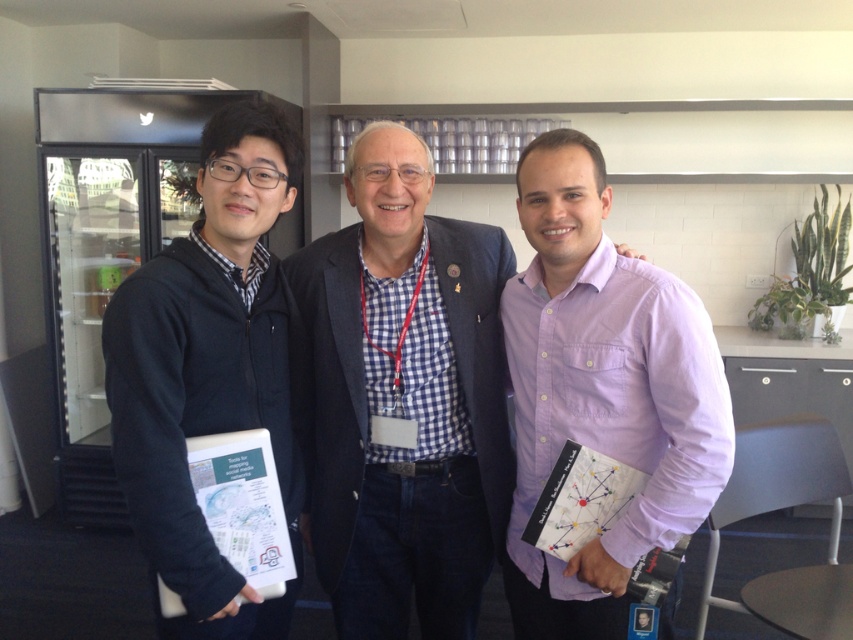
Question: Which point is farther to the camera?

Choices:
 (A) (231, 305)
 (B) (366, 445)
 (C) (718, 440)

Answer: (B)

Question: Is purple cotton shirt at center behind dark blue hoodie at left?

Choices:
 (A) no
 (B) yes

Answer: (B)

Question: Considering the relative positions of purple cotton shirt at center and dark blue hoodie at left in the image provided, where is purple cotton shirt at center located with respect to dark blue hoodie at left?

Choices:
 (A) right
 (B) left

Answer: (A)

Question: Which point is closer to the camera?

Choices:
 (A) (381, 536)
 (B) (225, 236)

Answer: (B)

Question: Among these objects, which one is nearest to the camera?

Choices:
 (A) purple cotton shirt at center
 (B) checkered fabric shirt at center

Answer: (A)

Question: In this image, where is checkered fabric shirt at center located relative to dark blue hoodie at left?

Choices:
 (A) right
 (B) left

Answer: (A)